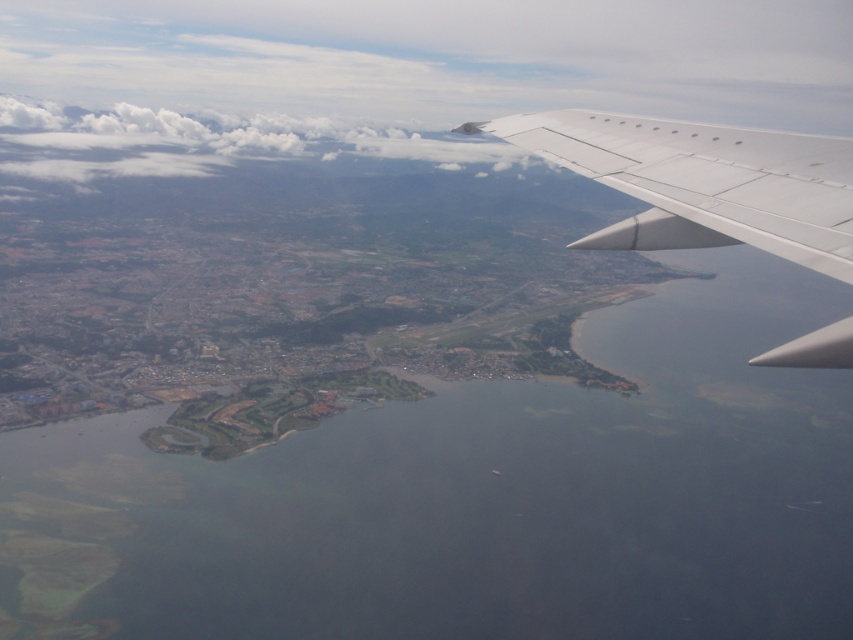
Question: Is white matte wing at upper right below white fluffy cloud at upper left?

Choices:
 (A) no
 (B) yes

Answer: (B)

Question: Which point is closer to the camera taking this photo?

Choices:
 (A) (613, 182)
 (B) (280, 147)

Answer: (A)

Question: Which point is closer to the camera?

Choices:
 (A) white matte wing at upper right
 (B) white fluffy cloud at upper left

Answer: (A)

Question: Observing the image, what is the correct spatial positioning of white matte wing at upper right in reference to white fluffy cloud at upper left?

Choices:
 (A) right
 (B) left

Answer: (A)

Question: Which point is closer to the camera taking this photo?

Choices:
 (A) (666, 192)
 (B) (474, 161)

Answer: (A)

Question: Does white matte wing at upper right have a larger size compared to white fluffy cloud at upper left?

Choices:
 (A) yes
 (B) no

Answer: (B)